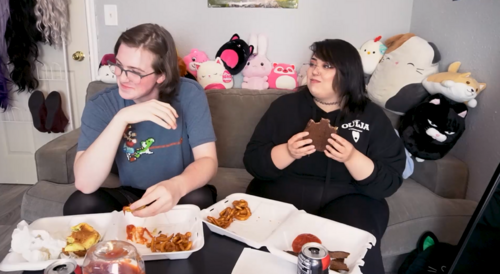
The width and height of the screenshot is (500, 274). Identify the location of cushion. (233, 185), (425, 204).